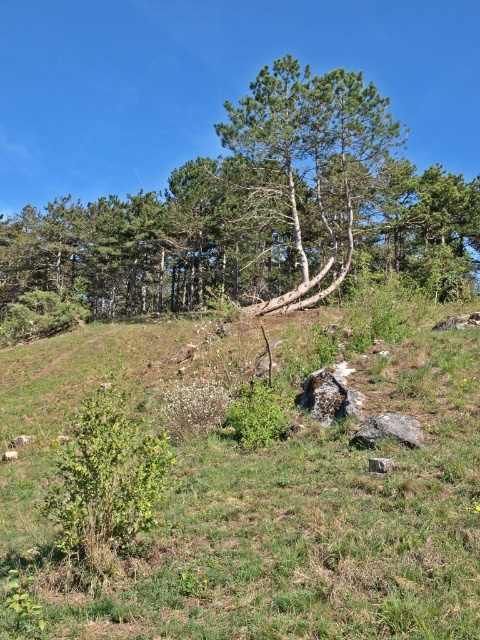
Is gray rough rock at lower center to the right of gray rough stone at center from the viewer's perspective?

Yes, gray rough rock at lower center is to the right of gray rough stone at center.

Can you confirm if gray rough rock at lower center is positioned below gray rough stone at center?

Actually, gray rough rock at lower center is above gray rough stone at center.

Which is in front, point (408, 428) or point (374, 472)?

Point (374, 472) is more forward.

Locate an element on the screen. This screenshot has width=480, height=640. gray rough rock at lower center is located at coordinates (388, 429).

Who is lower down, green leafy pine forest at center or gray rough rock at lower center?

gray rough rock at lower center is lower down.

Identify the location of green leafy pine forest at center. The width and height of the screenshot is (480, 640). (260, 214).

Which is more to the right, green grassy at center or green leafy pine forest at center?

green grassy at center is more to the right.

Which is behind, point (477, 602) or point (423, 209)?

Positioned behind is point (423, 209).

Is point (180, 346) behind point (206, 237)?

No, (180, 346) is in front of (206, 237).

Find the location of a particular element. green grassy at center is located at coordinates 262,492.